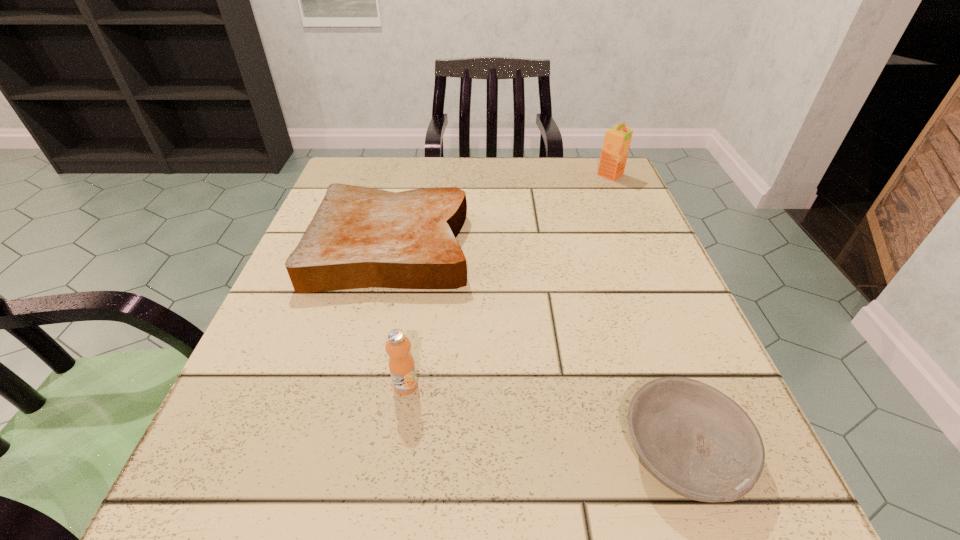
Where is `blank space located 0.240m on the back of the bread`? The image size is (960, 540). blank space located 0.240m on the back of the bread is located at coordinates (413, 157).

Locate an element on the screen. This screenshot has width=960, height=540. free space located on the back of the shortest object is located at coordinates (609, 240).

The image size is (960, 540). What are the coordinates of `orange juice that is at the far edge` in the screenshot? It's located at (617, 139).

Find the location of a particular element. The height and width of the screenshot is (540, 960). bread situated at the far edge is located at coordinates (360, 237).

The width and height of the screenshot is (960, 540). I want to click on object situated at the near edge, so click(x=698, y=442).

The image size is (960, 540). What are the coordinates of `object located at the left edge` in the screenshot? It's located at (360, 237).

Find the location of a particular element. Image resolution: width=960 pixels, height=540 pixels. orange juice that is at the right edge is located at coordinates (617, 139).

Identify the location of bowl that is at the right edge. (698, 442).

Where is `object located at the far left corner`? The image size is (960, 540). object located at the far left corner is located at coordinates (360, 237).

Image resolution: width=960 pixels, height=540 pixels. I want to click on object that is at the far right corner, so click(617, 139).